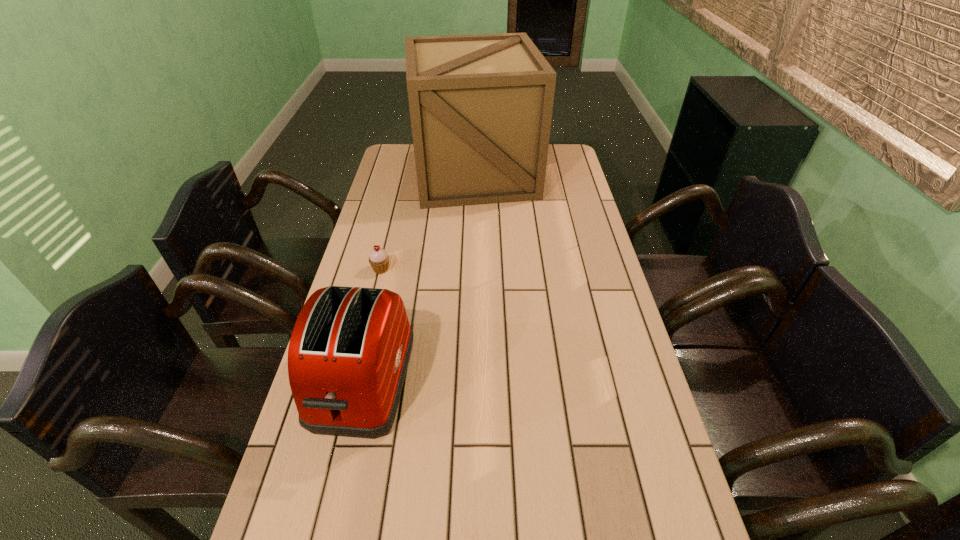
Where is `the farthest object`? the farthest object is located at coordinates click(x=481, y=105).

I want to click on box, so click(481, 105).

This screenshot has height=540, width=960. Identify the location of toaster. (349, 351).

Where is `the nearest object`? The width and height of the screenshot is (960, 540). the nearest object is located at coordinates (349, 351).

Identify the location of the shortest object. Image resolution: width=960 pixels, height=540 pixels. (379, 259).

Identify the location of cupcake. Image resolution: width=960 pixels, height=540 pixels. (379, 259).

Locate an element on the screen. The width and height of the screenshot is (960, 540). free location located 0.120m on the right of the box is located at coordinates (569, 173).

Find the location of a particular element. The width and height of the screenshot is (960, 540). vacant space situated 0.150m on the back of the nearest object is located at coordinates (384, 286).

Where is `free space located on the back of the second farthest object`? This screenshot has height=540, width=960. free space located on the back of the second farthest object is located at coordinates click(399, 195).

Locate an element on the screen. The height and width of the screenshot is (540, 960). object at the far edge is located at coordinates (481, 105).